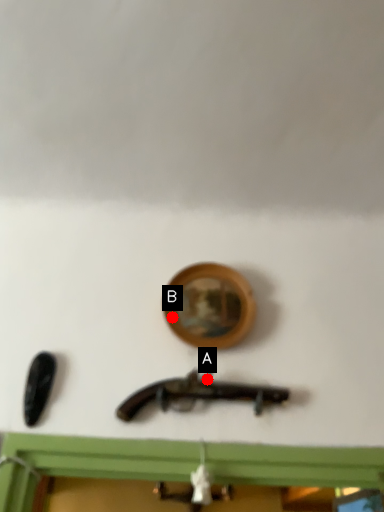
Question: Two points are circled on the image, labeled by A and B beside each circle. Which of the following is the closest to the observer?

Choices:
 (A) A is closer
 (B) B is closer

Answer: (A)